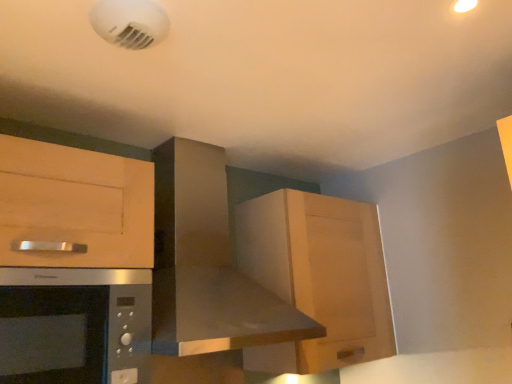
Question: Considering the relative positions of wooden cabinet at upper right and stainless steel range hood at center in the image provided, is wooden cabinet at upper right to the left or to the right of stainless steel range hood at center?

Choices:
 (A) right
 (B) left

Answer: (A)

Question: Does point (273, 355) appear closer or farther from the camera than point (174, 185)?

Choices:
 (A) closer
 (B) farther

Answer: (B)

Question: Which of these objects is positioned closest to the stainless steel range hood at center?

Choices:
 (A) wooden cabinet at upper right
 (B) satin silver microwave at lower left

Answer: (A)

Question: Estimate the real-world distances between objects in this image. Which object is farther from the stainless steel range hood at center?

Choices:
 (A) wooden cabinet at upper right
 (B) satin silver microwave at lower left

Answer: (B)